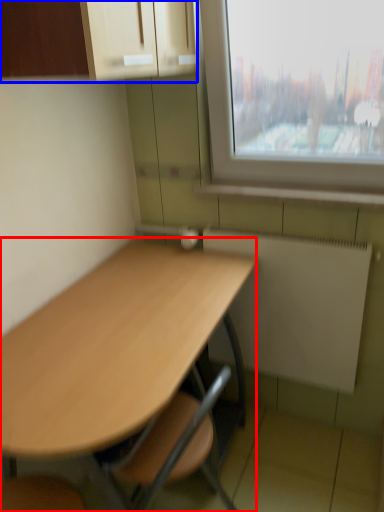
Question: Which object is further to the camera taking this photo, desk (highlighted by a red box) or cabinetry (highlighted by a blue box)?

Choices:
 (A) desk
 (B) cabinetry

Answer: (B)